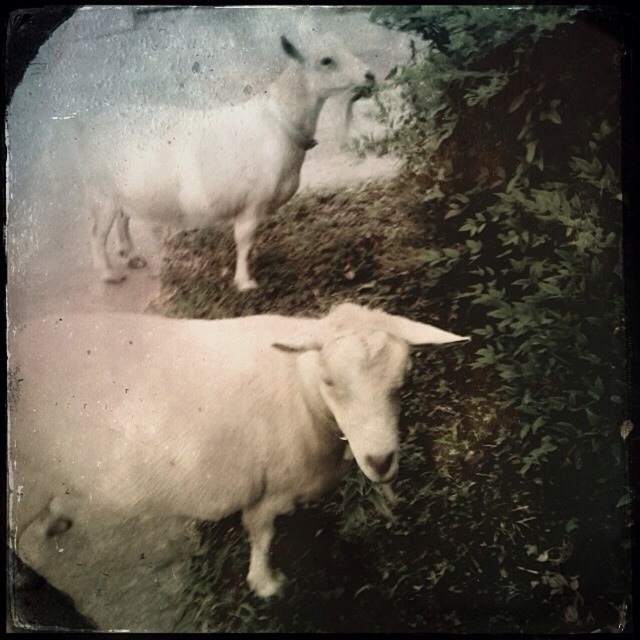
Question: Among these points, which one is farthest from the camera?

Choices:
 (A) (269, 596)
 (B) (499, 193)

Answer: (B)

Question: Is green leafy grass at upper center wider than white woolen sheep at lower left?

Choices:
 (A) yes
 (B) no

Answer: (A)

Question: Does green leafy grass at upper center appear on the left side of white woolen goat at upper center?

Choices:
 (A) no
 (B) yes

Answer: (A)

Question: Which point is farther to the camera?

Choices:
 (A) green leafy grass at upper center
 (B) white woolen sheep at lower left

Answer: (B)

Question: Does green leafy grass at upper center lie in front of white woolen sheep at lower left?

Choices:
 (A) yes
 (B) no

Answer: (A)

Question: Estimate the real-world distances between objects in this image. Which object is farther from the white woolen sheep at lower left?

Choices:
 (A) green leafy grass at upper center
 (B) white woolen goat at upper center

Answer: (B)